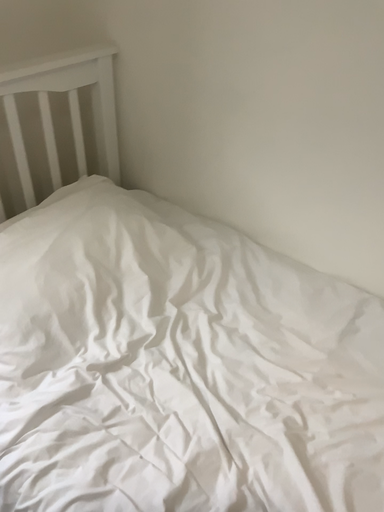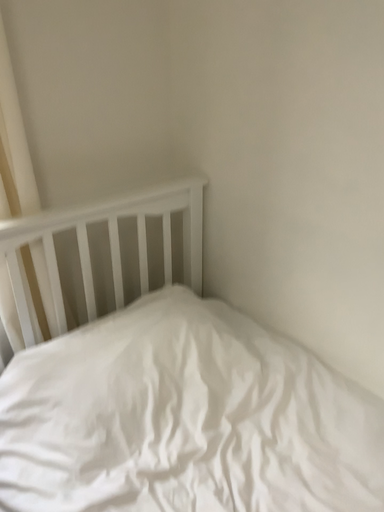
Question: Which way did the camera rotate in the video?

Choices:
 (A) rotated downward
 (B) rotated upward

Answer: (B)